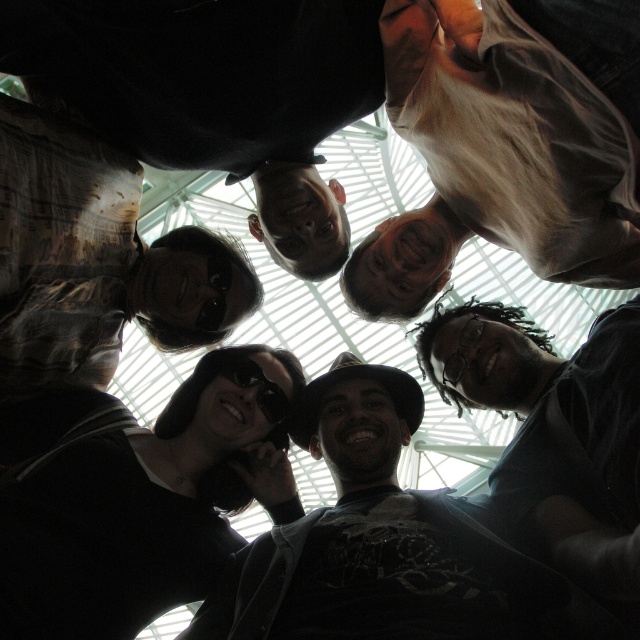
Question: Is light brown shirt at upper right above dark gray shirt at center?

Choices:
 (A) yes
 (B) no

Answer: (A)

Question: Which of the following is the farthest from the observer?

Choices:
 (A) (605, 323)
 (B) (493, 568)

Answer: (A)

Question: Is matte black shirt at center below dark gray shirt at center?

Choices:
 (A) yes
 (B) no

Answer: (A)

Question: Among these points, which one is nearest to the camera?

Choices:
 (A) coord(451,42)
 (B) coord(538,580)

Answer: (B)

Question: Which point is closer to the camera taking this photo?

Choices:
 (A) [586, 388]
 (B) [355, 620]

Answer: (B)

Question: Does light brown shirt at upper right have a larger size compared to dark gray shirt at center?

Choices:
 (A) yes
 (B) no

Answer: (A)